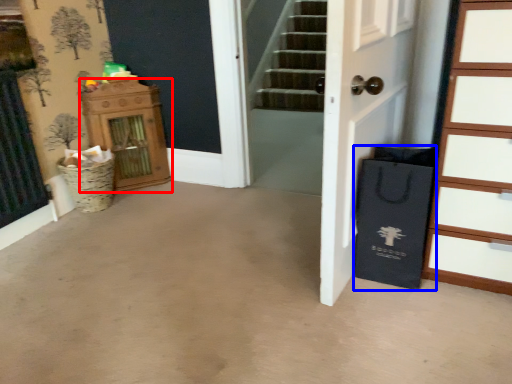
Question: Which object is closer to the camera taking this photo, dresser (highlighted by a red box) or shopping bag (highlighted by a blue box)?

Choices:
 (A) dresser
 (B) shopping bag

Answer: (B)